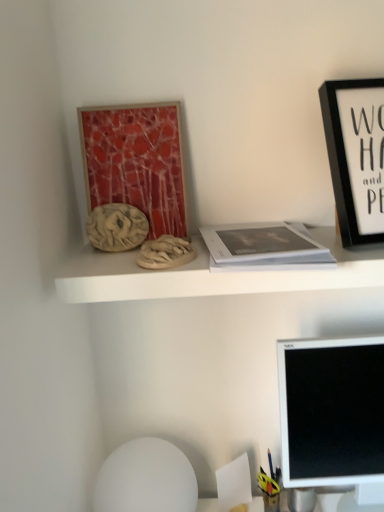
Question: Does matte red mosaic art at upper left appear on the left side of white matte sphere at lower center?

Choices:
 (A) no
 (B) yes

Answer: (B)

Question: From a real-world perspective, is matte red mosaic art at upper left beneath white matte sphere at lower center?

Choices:
 (A) no
 (B) yes

Answer: (A)

Question: Is matte red mosaic art at upper left far from white matte sphere at lower center?

Choices:
 (A) no
 (B) yes

Answer: (A)

Question: Is matte red mosaic art at upper left outside white matte sphere at lower center?

Choices:
 (A) no
 (B) yes

Answer: (B)

Question: Is matte red mosaic art at upper left beside white matte sphere at lower center?

Choices:
 (A) yes
 (B) no

Answer: (B)

Question: Is matte red mosaic art at upper left thinner than white matte sphere at lower center?

Choices:
 (A) yes
 (B) no

Answer: (A)

Question: Is white glossy computer monitor at lower right not within matte wood shelf at upper center?

Choices:
 (A) no
 (B) yes

Answer: (B)

Question: Is white glossy computer monitor at lower right touching matte wood shelf at upper center?

Choices:
 (A) yes
 (B) no

Answer: (B)

Question: Can matte wood shelf at upper center be found inside white glossy computer monitor at lower right?

Choices:
 (A) yes
 (B) no

Answer: (B)

Question: Is the depth of white glossy computer monitor at lower right greater than that of matte wood shelf at upper center?

Choices:
 (A) yes
 (B) no

Answer: (A)

Question: From a real-world perspective, is white glossy computer monitor at lower right positioned under matte wood shelf at upper center based on gravity?

Choices:
 (A) yes
 (B) no

Answer: (A)

Question: Is matte wood shelf at upper center at the back of white glossy computer monitor at lower right?

Choices:
 (A) no
 (B) yes

Answer: (A)

Question: From a real-world perspective, is black matte picture frame at upper right on top of white matte book at center?

Choices:
 (A) yes
 (B) no

Answer: (A)